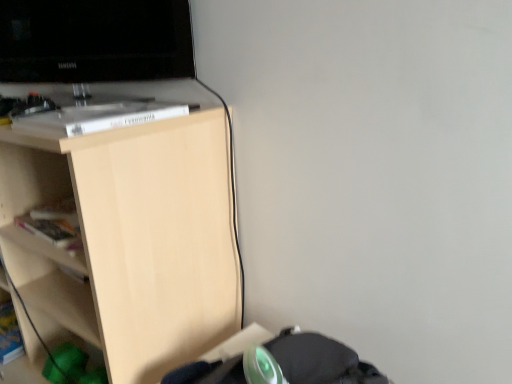
Find the location of `black glossy television at upper left`. black glossy television at upper left is located at coordinates (94, 41).

The image size is (512, 384). What do you see at coordinates (94, 41) in the screenshot?
I see `black glossy television at upper left` at bounding box center [94, 41].

What do you see at coordinates (128, 241) in the screenshot? I see `light wood shelf at upper left` at bounding box center [128, 241].

Identify the location of light wood shelf at upper left. This screenshot has height=384, width=512. (128, 241).

Where is `black glossy television at upper left`? This screenshot has height=384, width=512. black glossy television at upper left is located at coordinates (94, 41).

Would you say black glossy television at upper left is to the left or to the right of light wood shelf at upper left in the picture?

In the image, black glossy television at upper left appears on the right side of light wood shelf at upper left.

Which is in front, black glossy television at upper left or light wood shelf at upper left?

light wood shelf at upper left is in front.

Is point (34, 68) in front of point (58, 324)?

No.

From the image's perspective, relative to light wood shelf at upper left, is black glossy television at upper left above or below?

From the image's perspective, black glossy television at upper left appears above light wood shelf at upper left.

From a real-world perspective, is black glossy television at upper left physically above light wood shelf at upper left?

Yes, from a real-world perspective, black glossy television at upper left is over light wood shelf at upper left

Which of these two, black glossy television at upper left or light wood shelf at upper left, is thinner?

black glossy television at upper left.

Which of these two, black glossy television at upper left or light wood shelf at upper left, stands shorter?

Standing shorter between the two is black glossy television at upper left.

Is black glossy television at upper left bigger than light wood shelf at upper left?

Incorrect, black glossy television at upper left is not larger than light wood shelf at upper left.

Is light wood shelf at upper left located within black glossy television at upper left?

No, light wood shelf at upper left is not surrounded by black glossy television at upper left.

Does black glossy television at upper left touch light wood shelf at upper left?

black glossy television at upper left and light wood shelf at upper left are not in contact.

Is black glossy television at upper left facing towards light wood shelf at upper left?

No, black glossy television at upper left does not turn towards light wood shelf at upper left.

Can you tell me how much black glossy television at upper left and light wood shelf at upper left differ in facing direction?

They differ by 21.7 degrees in their facing directions.

Locate an element on the screen. The width and height of the screenshot is (512, 384). shelf below the black glossy television at upper left (from a real-world perspective) is located at coordinates (128, 241).

Which is more to the right, light wood shelf at upper left or black glossy television at upper left?

black glossy television at upper left.

Which is behind, light wood shelf at upper left or black glossy television at upper left?

black glossy television at upper left is more distant.

Considering the positions of point (142, 304) and point (59, 14), is point (142, 304) closer or farther from the camera than point (59, 14)?

Point (142, 304) appears to be closer to the viewer than point (59, 14).

Based on the photo, from the image's perspective, is light wood shelf at upper left located above or below black glossy television at upper left?

Based on their image positions, light wood shelf at upper left is located beneath black glossy television at upper left.

From a real-world perspective, relative to black glossy television at upper left, is light wood shelf at upper left vertically above or below?

light wood shelf at upper left is below black glossy television at upper left.

Does light wood shelf at upper left have a lesser width compared to black glossy television at upper left?

No.

From their relative heights in the image, would you say light wood shelf at upper left is taller or shorter than black glossy television at upper left?

Clearly, light wood shelf at upper left is taller compared to black glossy television at upper left.

Is light wood shelf at upper left bigger or smaller than black glossy television at upper left?

In the image, light wood shelf at upper left appears to be larger than black glossy television at upper left.

Is light wood shelf at upper left situated inside black glossy television at upper left or outside?

light wood shelf at upper left is outside black glossy television at upper left.

Is light wood shelf at upper left touching black glossy television at upper left?

No.

Is light wood shelf at upper left oriented away from black glossy television at upper left?

That's not correct — light wood shelf at upper left is not looking away from black glossy television at upper left.

Based on the photo, can you tell me how much light wood shelf at upper left and black glossy television at upper left differ in facing direction?

21.7 degrees separate the facing orientations of light wood shelf at upper left and black glossy television at upper left.

How much distance is there between light wood shelf at upper left and black glossy television at upper left?

light wood shelf at upper left and black glossy television at upper left are 45.91 centimeters apart.

In order to click on shelf on the left of black glossy television at upper left in this screenshot , I will do `click(128, 241)`.

Locate an element on the screen. The height and width of the screenshot is (384, 512). television lying above the light wood shelf at upper left (from the image's perspective) is located at coordinates (94, 41).

Identify the location of television located behind the light wood shelf at upper left. (94, 41).